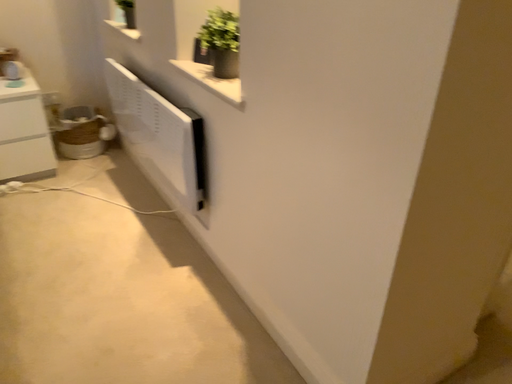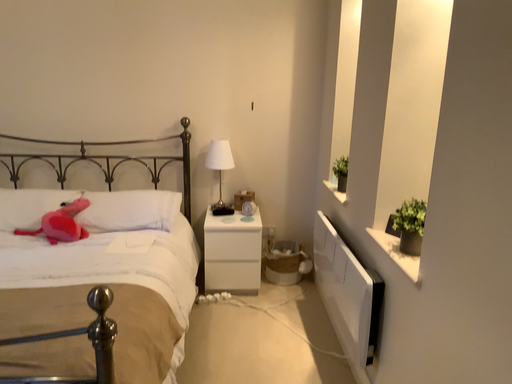
Question: Which way did the camera rotate in the video?

Choices:
 (A) rotated left
 (B) rotated right

Answer: (A)